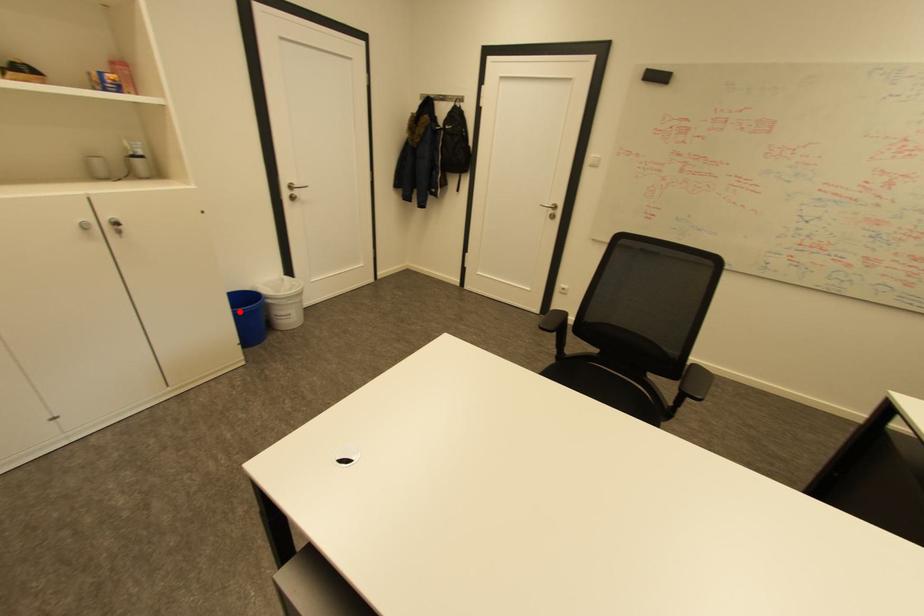
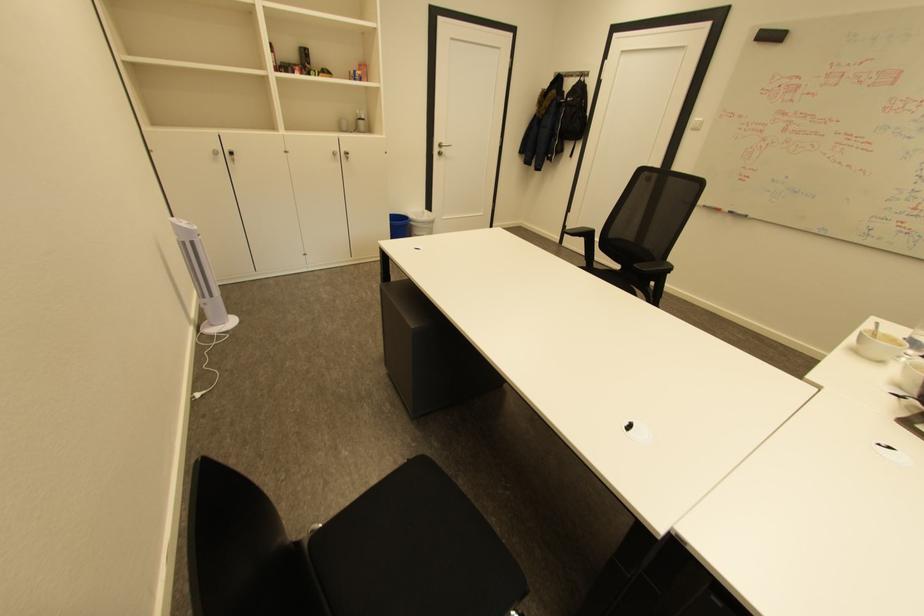
The point at the highlighted location is marked in the first image. Where is the corresponding point in the second image?

(396, 223)